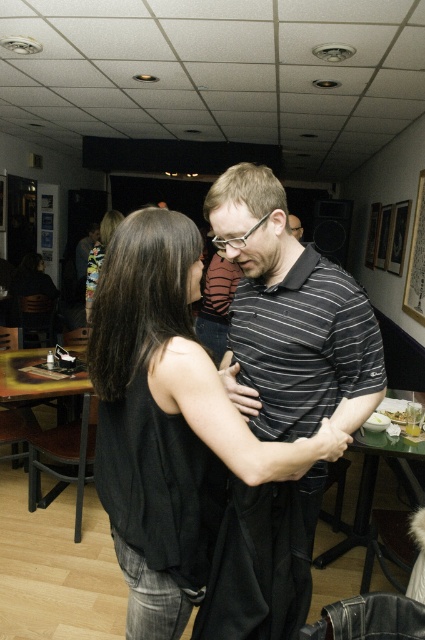
Who is taller, striped cotton polo shirt at center or striped cotton shirt at center?

striped cotton polo shirt at center

Is striped cotton polo shirt at center further to camera compared to striped cotton shirt at center?

No.

Between point (257, 432) and point (302, 227), which one is positioned in front?

Point (257, 432) is more forward.

This screenshot has height=640, width=425. I want to click on striped cotton polo shirt at center, so tap(291, 317).

Describe the element at coordinates (99, 257) in the screenshot. The width and height of the screenshot is (425, 640). I see `shiny black hair at center` at that location.

Can you confirm if shiny black hair at center is positioned below striped cotton shirt at center?

Yes.

Between point (102, 246) and point (300, 225), which one is positioned behind?

Positioned behind is point (300, 225).

Find the location of a particular element. shiny black hair at center is located at coordinates (99, 257).

Is black cotton tank top at center taller than striped cotton polo shirt at center?

No, black cotton tank top at center is not taller than striped cotton polo shirt at center.

Is black cotton tank top at center behind striped cotton polo shirt at center?

No, black cotton tank top at center is closer to the viewer.

At what (x,y) coordinates should I click in order to perform the action: click on black cotton tank top at center. Please return your answer as a coordinate pair (x, y). This screenshot has width=425, height=640. Looking at the image, I should click on (167, 422).